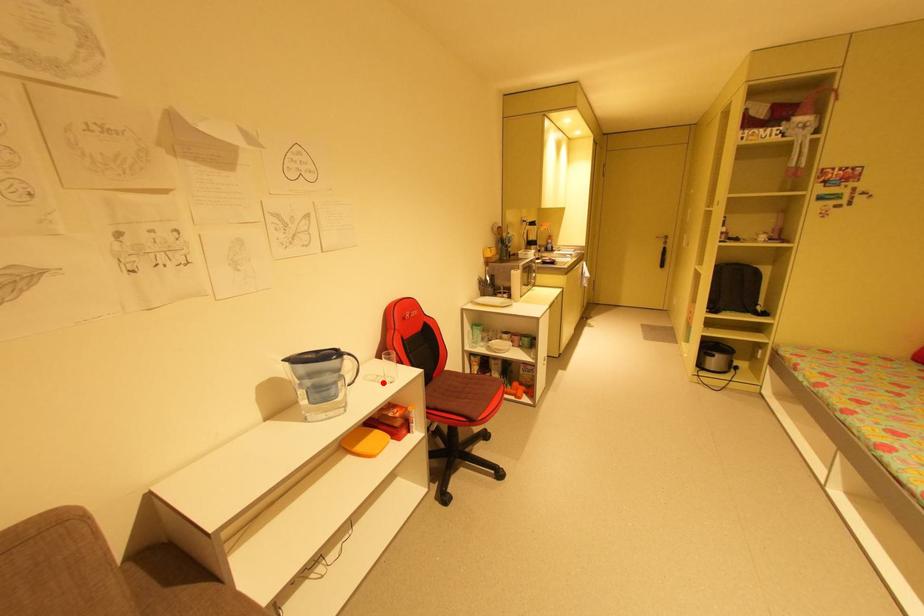
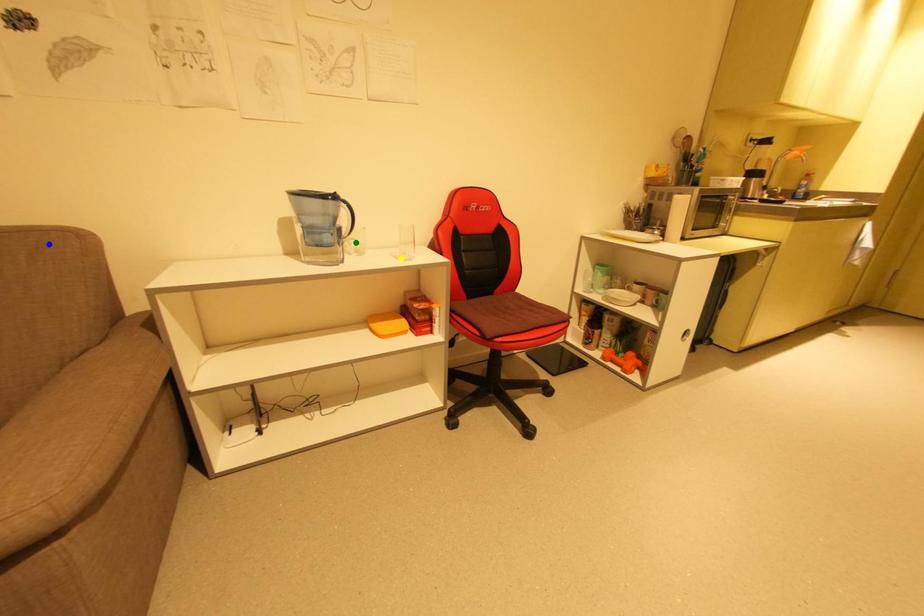
Question: I am providing you with two images of the same scene from different viewpoints. A red point is marked on the first image. You are given multiple points on the second image. Which mark in image 2 goes with the point in image 1?

Choices:
 (A) yellow point
 (B) blue point
 (C) green point

Answer: (A)